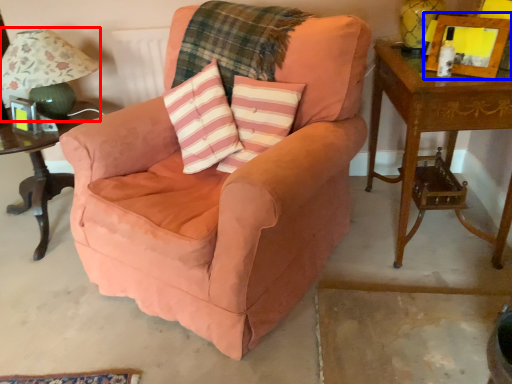
Question: Which of the following is the closest to the observer, table lamp (highlighted by a red box) or picture frame (highlighted by a blue box)?

Choices:
 (A) table lamp
 (B) picture frame

Answer: (B)